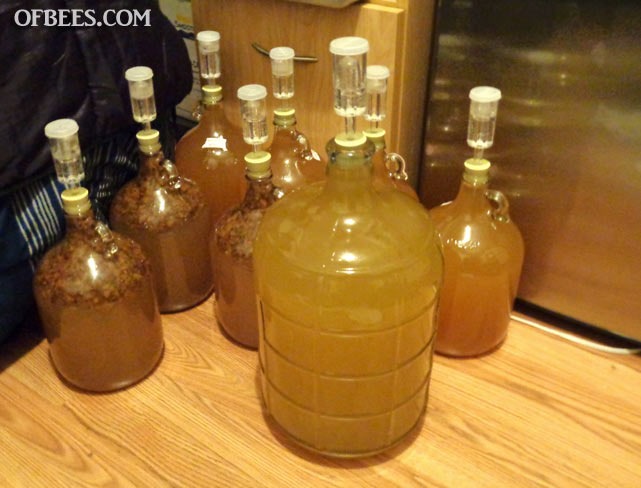
Find the location of a particular element. bottle is located at coordinates (219, 186).